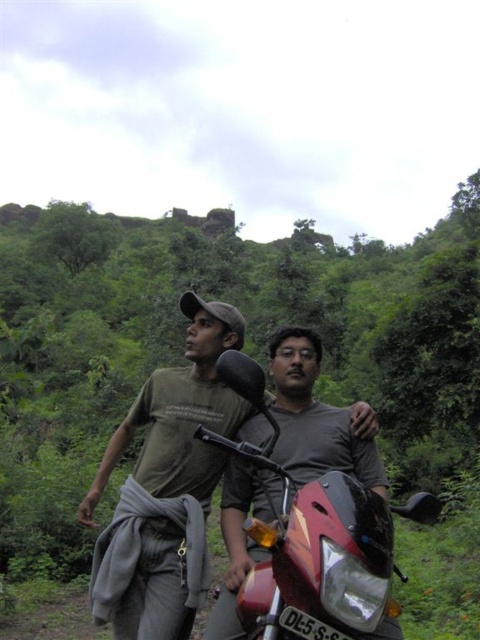
Question: Which point is farther to the camera?

Choices:
 (A) (394, 605)
 (B) (110, 400)
 (C) (166, 404)

Answer: (B)

Question: Which of these objects is positioned closest to the shiny red motorcycle at center?

Choices:
 (A) green cotton shirt at center
 (B) green leafy vegetation at center

Answer: (A)

Question: Does green leafy vegetation at center have a greater width compared to shiny red motorcycle at center?

Choices:
 (A) yes
 (B) no

Answer: (A)

Question: Can you confirm if green leafy vegetation at center is wider than green cotton shirt at center?

Choices:
 (A) yes
 (B) no

Answer: (A)

Question: Is green leafy vegetation at center wider than shiny red motorcycle at center?

Choices:
 (A) yes
 (B) no

Answer: (A)

Question: Which object appears closest to the camera in this image?

Choices:
 (A) green leafy vegetation at center
 (B) shiny red motorcycle at center
 (C) green cotton shirt at center

Answer: (B)